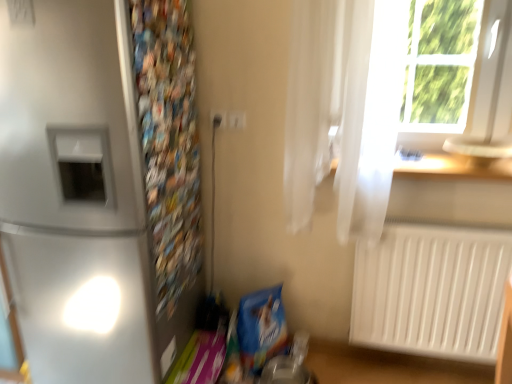
Question: Should I look upward or downward to see multicolored paper at left?

Choices:
 (A) up
 (B) down

Answer: (A)

Question: From a real-world perspective, is white plastic radiator at lower right over satin silver refrigerator at left?

Choices:
 (A) no
 (B) yes

Answer: (A)

Question: From a real-world perspective, is white plastic radiator at lower right under satin silver refrigerator at left?

Choices:
 (A) no
 (B) yes

Answer: (B)

Question: Is satin silver refrigerator at left at the back of white plastic radiator at lower right?

Choices:
 (A) no
 (B) yes

Answer: (A)

Question: Does white plastic radiator at lower right come in front of satin silver refrigerator at left?

Choices:
 (A) no
 (B) yes

Answer: (A)

Question: From the image's perspective, would you say white plastic radiator at lower right is shown under satin silver refrigerator at left?

Choices:
 (A) no
 (B) yes

Answer: (B)

Question: Is white plastic radiator at lower right smaller than satin silver refrigerator at left?

Choices:
 (A) no
 (B) yes

Answer: (B)

Question: Is white sheer curtain at upper right directly adjacent to white plastic electric outlet at upper center, which is counted as the first electric outlet, starting from the right?

Choices:
 (A) yes
 (B) no

Answer: (B)

Question: Does white sheer curtain at upper right have a greater width compared to white plastic electric outlet at upper center, which is counted as the first electric outlet, starting from the right?

Choices:
 (A) no
 (B) yes

Answer: (B)

Question: Does white sheer curtain at upper right have a greater height compared to white plastic electric outlet at upper center, which is counted as the first electric outlet, starting from the right?

Choices:
 (A) no
 (B) yes

Answer: (B)

Question: Is the position of white sheer curtain at upper right less distant than that of white plastic electric outlet at upper center, which is counted as the first electric outlet, starting from the right?

Choices:
 (A) yes
 (B) no

Answer: (A)

Question: Could you tell me if white sheer curtain at upper right is facing white plastic electric outlet at upper center, marked as the 2th electric outlet in a left-to-right arrangement?

Choices:
 (A) no
 (B) yes

Answer: (A)

Question: Considering the relative positions of white sheer curtain at upper right and white plastic electric outlet at upper center, marked as the 2th electric outlet in a left-to-right arrangement, in the image provided, is white sheer curtain at upper right to the left of white plastic electric outlet at upper center, marked as the 2th electric outlet in a left-to-right arrangement, from the viewer's perspective?

Choices:
 (A) no
 (B) yes

Answer: (A)

Question: Considering the relative positions of white plastic window frame at upper right and white plastic radiator at lower right in the image provided, is white plastic window frame at upper right in front of white plastic radiator at lower right?

Choices:
 (A) no
 (B) yes

Answer: (B)